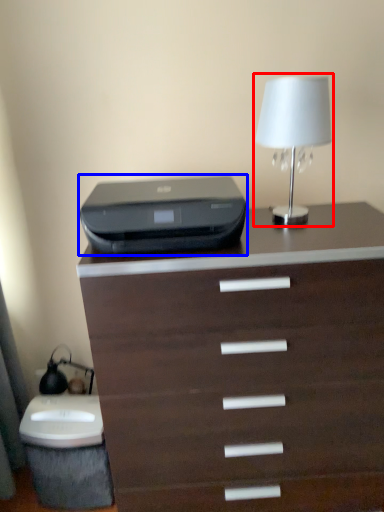
Question: Which object appears closest to the camera in this image, table lamp (highlighted by a red box) or printer (highlighted by a blue box)?

Choices:
 (A) table lamp
 (B) printer

Answer: (B)